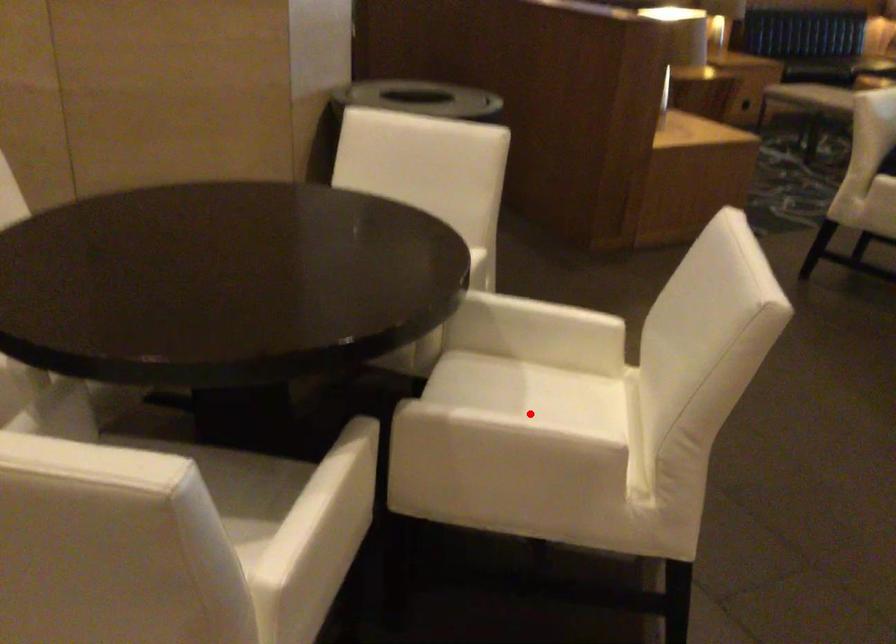
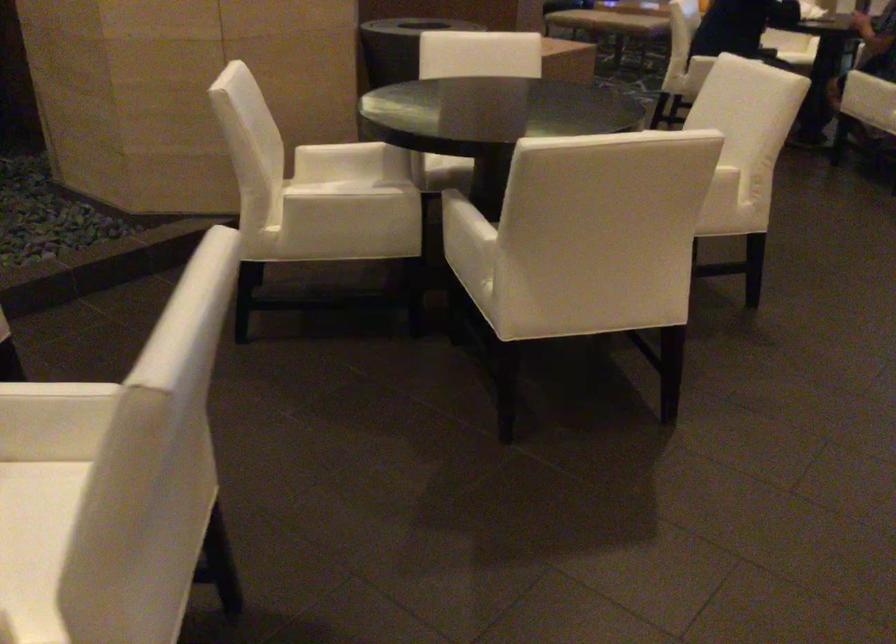
Question: I am providing you with two images of the same scene from different viewpoints. A red point is marked on the first image. At the location where the point appears in image 1, is it still visible in image 2?

Choices:
 (A) Yes
 (B) No

Answer: (B)